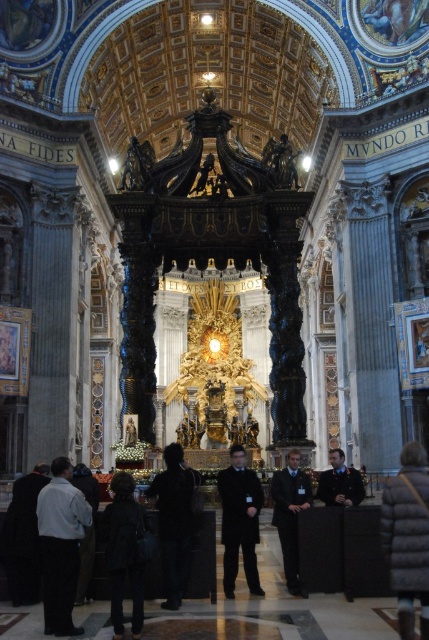
Is point (36, 522) more distant than point (120, 500)?

That is True.

What do you see at coordinates (60, 545) in the screenshot?
I see `dark gray suit at lower left` at bounding box center [60, 545].

Locate an element on the screen. dark gray suit at lower left is located at coordinates (60, 545).

Can you confirm if black matte coat at center is bigger than dark brown leather jacket at center?

Indeed, black matte coat at center has a larger size compared to dark brown leather jacket at center.

Who is taller, black matte coat at center or dark brown leather jacket at center?

With more height is black matte coat at center.

The height and width of the screenshot is (640, 429). Find the location of `black matte coat at center`. black matte coat at center is located at coordinates (175, 520).

Find the location of a particular element. The image size is (429, 640). black matte coat at center is located at coordinates (175, 520).

Who is positioned more to the right, black wool coat at lower left or dark brown leather jacket at center?

From the viewer's perspective, dark brown leather jacket at center appears more on the right side.

Is point (114, 554) positioned in front of point (296, 589)?

Yes, point (114, 554) is in front of point (296, 589).

Is point (138, 580) farther from viewer compared to point (307, 483)?

No, it is not.

Locate an element on the screen. black wool coat at lower left is located at coordinates (123, 552).